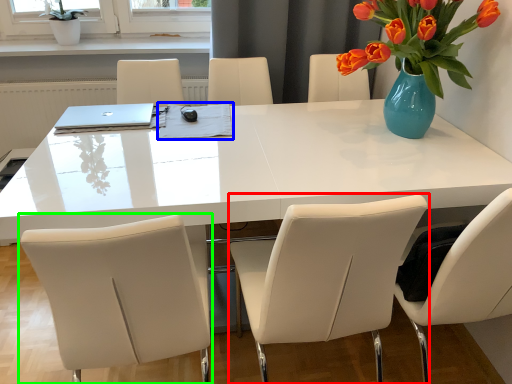
Question: Estimate the real-world distances between objects in this image. Which object is closer to chair (highlighted by a red box), notepad (highlighted by a blue box) or chair (highlighted by a green box)?

Choices:
 (A) notepad
 (B) chair

Answer: (B)